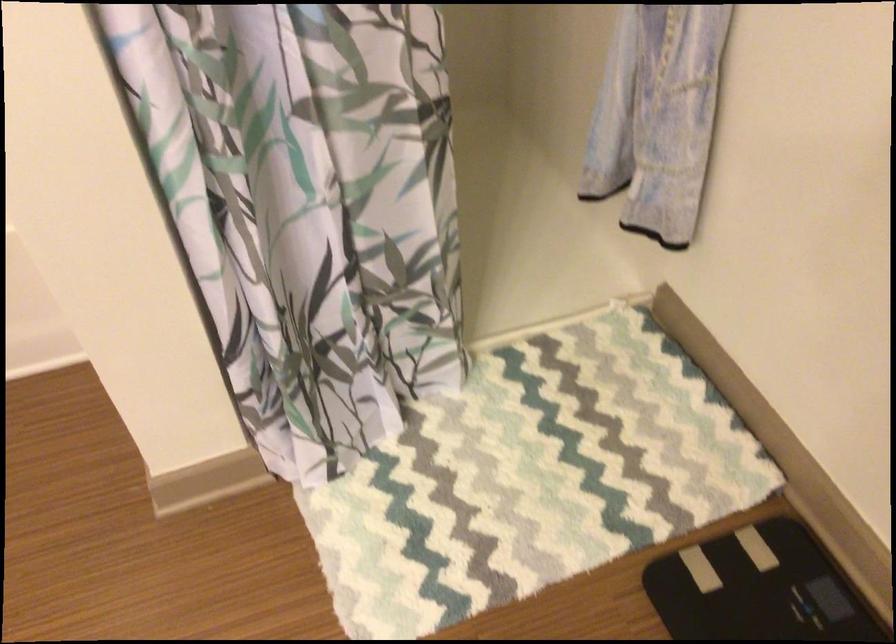
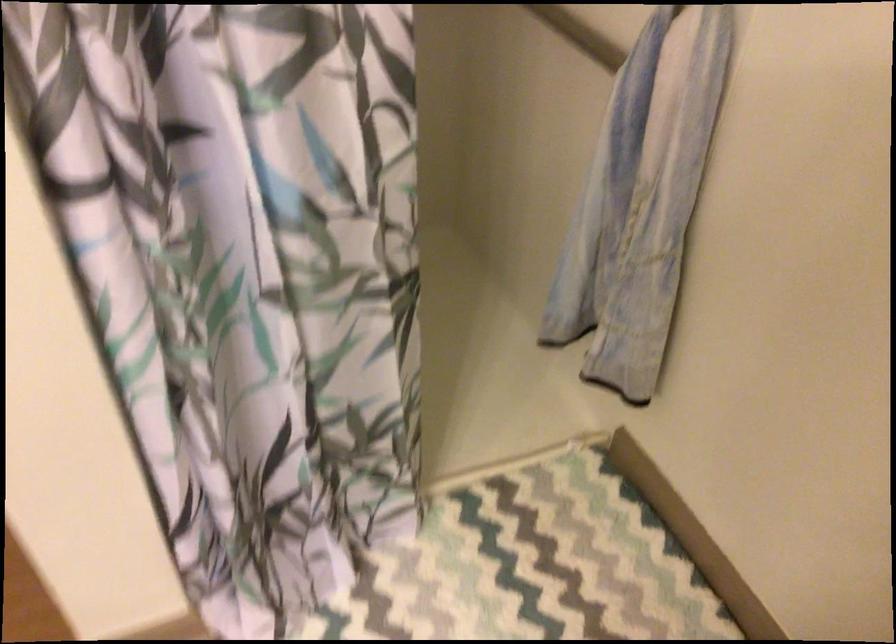
Question: Based on the continuous images, in which direction is the camera rotating? Reply with the corresponding letter.

Choices:
 (A) Left
 (B) Right
 (C) Up
 (D) Down

Answer: (B)